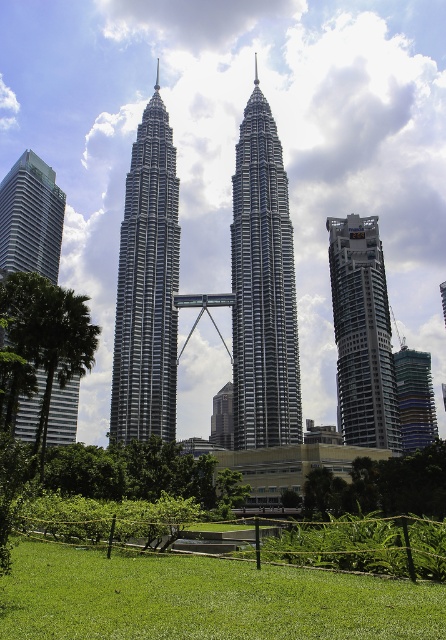
You are a tourist standing at the base of the Petronas Twin Towers. You notice the green grass at lower center and the matte glass skyscraper at left. Which object is closer to your feet?

The green grass at lower center is closer to your feet as it is positioned below the matte glass skyscraper at left.

You are standing in the urban landscape and want to take a photo of both the silver metallic twin towers at center and the matte glass skyscraper at left. Which one should you focus on first to ensure both are in frame?

You should focus on the silver metallic twin towers at center first since it is closer to you, allowing you to frame both the silver metallic twin towers at center and the matte glass skyscraper at left in the same shot.

Based on the photo, you are a landscape architect evaluating the urban space in front of the matte glass skyscraper at left. The green grass at lower center is part of the public area. Considering the description, which area takes up more space in the image?

The matte glass skyscraper at left occupies more space than the green grass at lower center in the image.